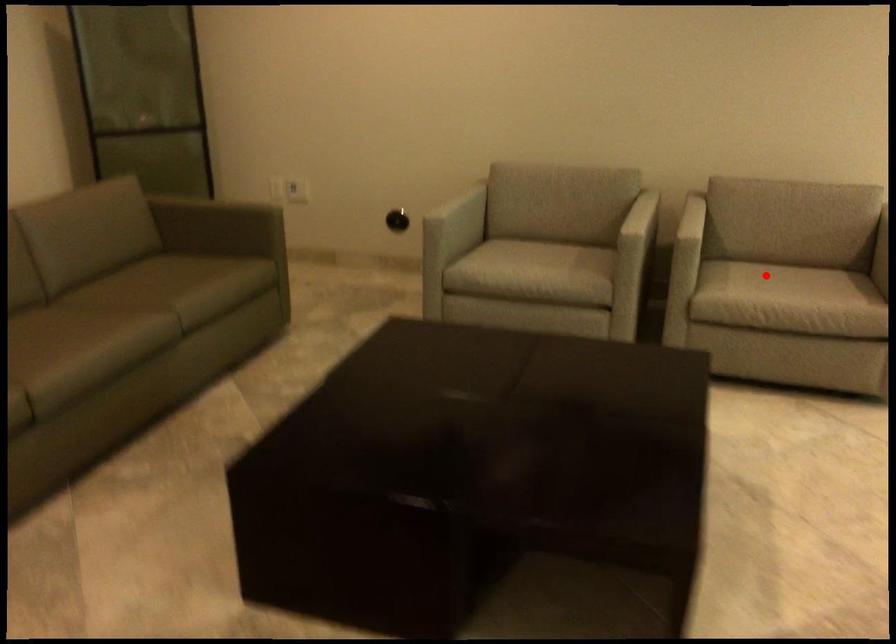
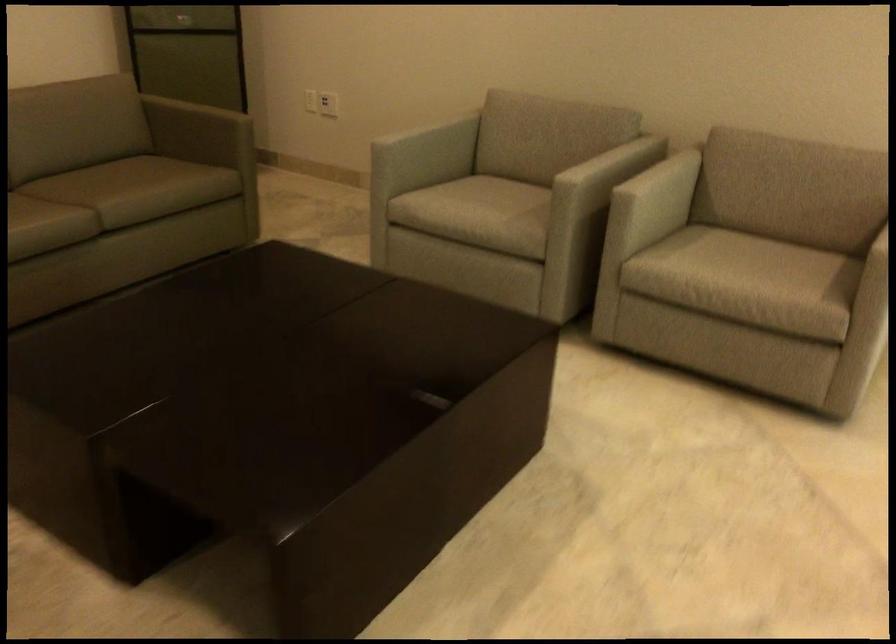
Question: I am providing you with two images of the same scene from different viewpoints. In image1, a red point is highlighted. Considering the same 3D point in image2, which of the following is correct?

Choices:
 (A) It is closer
 (B) It is farther

Answer: (A)